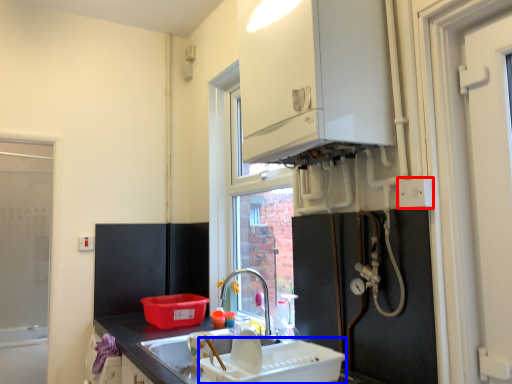
Question: Which of the following is the farthest to the observer, electric outlet (highlighted by a red box) or appliance (highlighted by a blue box)?

Choices:
 (A) electric outlet
 (B) appliance

Answer: (A)